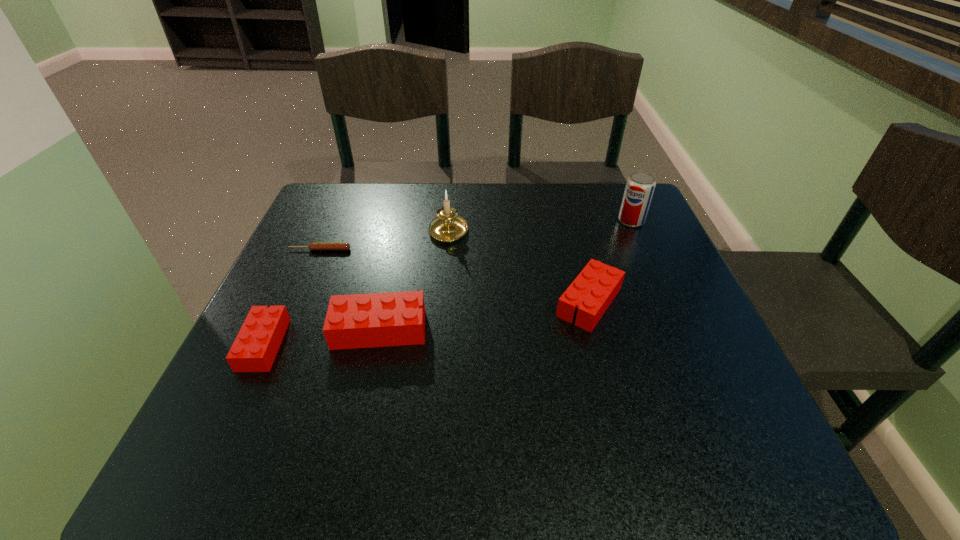
Locate an element on the screen. Image resolution: width=960 pixels, height=540 pixels. vacant space that is in between the rightmost Lego and the candle holder is located at coordinates (519, 266).

Where is `free space that is in between the candle holder and the second Lego from right to left`? Image resolution: width=960 pixels, height=540 pixels. free space that is in between the candle holder and the second Lego from right to left is located at coordinates (414, 279).

The height and width of the screenshot is (540, 960). I want to click on blank region between the second Lego from left to right and the sausage, so click(x=349, y=289).

Locate an element on the screen. free area in between the rightmost Lego and the fourth nearest object is located at coordinates 455,276.

At what (x,y) coordinates should I click in order to perform the action: click on free space between the leftmost Lego and the second Lego from right to left. Please return your answer as a coordinate pair (x, y). The width and height of the screenshot is (960, 540). Looking at the image, I should click on (322, 337).

Identify the location of free spot between the sausage and the rightmost Lego. Image resolution: width=960 pixels, height=540 pixels. (455, 276).

I want to click on free space between the third shortest object and the candle holder, so click(x=519, y=266).

Find the location of a particular element. Image resolution: width=960 pixels, height=540 pixels. empty space that is in between the second Lego from right to left and the second object from right to left is located at coordinates (485, 315).

This screenshot has height=540, width=960. Identify the location of vacant region between the candle holder and the second Lego from right to left. (414, 279).

Point out which object is positioned as the second nearest to the second shortest object. Please provide its 2D coordinates. Your answer should be formatted as a tuple, i.e. [(x, y)], where the tuple contains the x and y coordinates of a point satisfying the conditions above.

[(336, 246)]